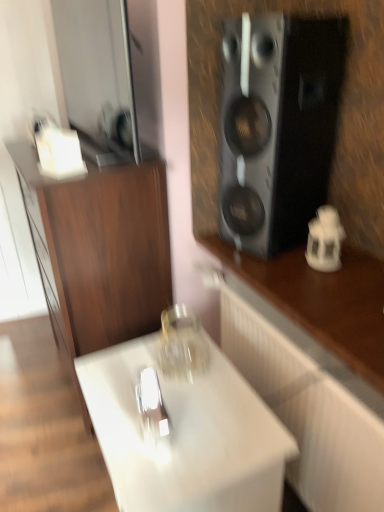
Find the location of a particular element. This screenshot has height=512, width=384. wooden cabinet at left, which appears as the 1th cabinetry when viewed from the left is located at coordinates (99, 251).

Locate an element on the screen. The image size is (384, 512). white glossy table at center is located at coordinates (186, 436).

Considering the positions of objects transparent glass jar at center and wooden cabinet at left, which appears as the 1th cabinetry when viewed from the left, in the image provided, who is in front, transparent glass jar at center or wooden cabinet at left, which appears as the 1th cabinetry when viewed from the left,?

transparent glass jar at center is in front.

From a real-world perspective, is transparent glass jar at center on top of wooden cabinet at left, which appears as the 1th cabinetry when viewed from the left?

Yes.

Can you tell me how much transparent glass jar at center and wooden cabinet at left, which appears as the 1th cabinetry when viewed from the left, differ in facing direction?

2.28 degrees.

Is transparent glass jar at center far from wooden cabinet at left, which is counted as the 2th cabinetry, starting from the right?

Actually, transparent glass jar at center and wooden cabinet at left, which is counted as the 2th cabinetry, starting from the right, are a little close together.

Measure the distance between wooden cabinet at left, which is counted as the 2th cabinetry, starting from the right, and white porcelain lantern at right.

wooden cabinet at left, which is counted as the 2th cabinetry, starting from the right, is 27.78 inches from white porcelain lantern at right.

Can you confirm if wooden cabinet at left, which appears as the 1th cabinetry when viewed from the left, is thinner than white porcelain lantern at right?

In fact, wooden cabinet at left, which appears as the 1th cabinetry when viewed from the left, might be wider than white porcelain lantern at right.

Does wooden cabinet at left, which is counted as the 2th cabinetry, starting from the right, lie behind white porcelain lantern at right?

No, the depth of wooden cabinet at left, which is counted as the 2th cabinetry, starting from the right, is less than that of white porcelain lantern at right.

You are a GUI agent. You are given a task and a screenshot of the screen. Output one action in this format:
    pyautogui.click(x=<x>, y=<y>)
    Task: Click on the cabinetry that is the 1st one below the white porcelain lantern at right (from a real-world perspective)
    
    Given the screenshot: What is the action you would take?
    pyautogui.click(x=99, y=251)

Between transparent glass jar at center and white porcelain lantern at right, which one appears on the left side from the viewer's perspective?

transparent glass jar at center.

From the picture: Is transparent glass jar at center facing away from white porcelain lantern at right?

Yes, transparent glass jar at center's orientation is away from white porcelain lantern at right.

Would you say transparent glass jar at center is a long distance from white porcelain lantern at right?

No.

Between white porcelain lantern at right and white glossy table at center, which one is positioned in front?

white glossy table at center is closer to the camera.

How far apart are white porcelain lantern at right and white glossy table at center?

white porcelain lantern at right and white glossy table at center are 27.64 inches apart.

From a real-world perspective, is white porcelain lantern at right physically above white glossy table at center?

Yes, from a real-world perspective, white porcelain lantern at right is over white glossy table at center

Considering the sizes of white porcelain lantern at right and white glossy table at center in the image, is white porcelain lantern at right taller or shorter than white glossy table at center?

Clearly, white porcelain lantern at right is shorter compared to white glossy table at center.

Who is smaller, transparent glass jar at center or white glossy table at center?

With smaller size is transparent glass jar at center.

Considering the relative sizes of transparent glass jar at center and white glossy table at center in the image provided, is transparent glass jar at center shorter than white glossy table at center?

Correct, transparent glass jar at center is not as tall as white glossy table at center.

From the image's perspective, is transparent glass jar at center located above or below white glossy table at center?

transparent glass jar at center is above white glossy table at center.

Is white porcelain lantern at right next to white glossy cabinet at lower center, the 1th cabinetry in the right-to-left sequence?

There is a gap between white porcelain lantern at right and white glossy cabinet at lower center, the 1th cabinetry in the right-to-left sequence.

From a real-world perspective, is white porcelain lantern at right located higher than white glossy cabinet at lower center, marked as the second cabinetry in a left-to-right arrangement?

Yes.

Considering the sizes of white porcelain lantern at right and white glossy cabinet at lower center, marked as the second cabinetry in a left-to-right arrangement, in the image, is white porcelain lantern at right taller or shorter than white glossy cabinet at lower center, marked as the second cabinetry in a left-to-right arrangement,?

Considering their sizes, white porcelain lantern at right has less height than white glossy cabinet at lower center, marked as the second cabinetry in a left-to-right arrangement.

Is white porcelain lantern at right not inside white glossy cabinet at lower center, marked as the second cabinetry in a left-to-right arrangement?

Yes.

Who is bigger, wooden cabinet at left, which appears as the 1th cabinetry when viewed from the left, or white glossy table at center?

wooden cabinet at left, which appears as the 1th cabinetry when viewed from the left.

Is point (154, 266) closer to viewer compared to point (150, 503)?

No, (154, 266) is further to viewer.

Is wooden cabinet at left, which is counted as the 2th cabinetry, starting from the right, looking in the opposite direction of white glossy table at center?

No, wooden cabinet at left, which is counted as the 2th cabinetry, starting from the right, is not facing away from white glossy table at center.

Can white glossy table at center be found inside wooden cabinet at left, which is counted as the 2th cabinetry, starting from the right?

No.

You are a GUI agent. You are given a task and a screenshot of the screen. Output one action in this format:
    pyautogui.click(x=<x>, y=<y>)
    Task: Click on the glass jar on the right of wooden cabinet at left, which appears as the 1th cabinetry when viewed from the left
    Image resolution: width=384 pixels, height=512 pixels.
    Given the screenshot: What is the action you would take?
    pyautogui.click(x=182, y=345)

I want to click on cabinetry that is the 1st one below the white porcelain lantern at right (from a real-world perspective), so click(99, 251).

Estimate the real-world distances between objects in this image. Which object is further from white porcelain lantern at right, transparent glass jar at center or white glossy cabinet at lower center, marked as the second cabinetry in a left-to-right arrangement?

The object further to white porcelain lantern at right is transparent glass jar at center.

Looking at the image, which one is located further to white glossy cabinet at lower center, the 1th cabinetry in the right-to-left sequence, wooden cabinet at left, which appears as the 1th cabinetry when viewed from the left, or black matte speaker at upper right?

Among the two, wooden cabinet at left, which appears as the 1th cabinetry when viewed from the left, is located further to white glossy cabinet at lower center, the 1th cabinetry in the right-to-left sequence.

Consider the image. From the image, which object appears to be farther from wooden cabinet at left, which is counted as the 2th cabinetry, starting from the right, white glossy table at center or white porcelain lantern at right?

white porcelain lantern at right.

When comparing their distances from white glossy cabinet at lower center, marked as the second cabinetry in a left-to-right arrangement, does wooden cabinet at left, which appears as the 1th cabinetry when viewed from the left, or white glossy table at center seem closer?

Based on the image, white glossy table at center appears to be nearer to white glossy cabinet at lower center, marked as the second cabinetry in a left-to-right arrangement.

When comparing their distances from white glossy cabinet at lower center, the 1th cabinetry in the right-to-left sequence, does black matte speaker at upper right or transparent glass jar at center seem closer?

transparent glass jar at center is closer to white glossy cabinet at lower center, the 1th cabinetry in the right-to-left sequence.

From the image, which object appears to be nearer to white glossy table at center, white glossy cabinet at lower center, the 1th cabinetry in the right-to-left sequence, or black matte speaker at upper right?

Based on the image, white glossy cabinet at lower center, the 1th cabinetry in the right-to-left sequence, appears to be nearer to white glossy table at center.

Consider the image. Considering their positions, is white glossy table at center positioned further to black matte speaker at upper right than white porcelain lantern at right?

Among the two, white glossy table at center is located further to black matte speaker at upper right.

Based on their spatial positions, is white glossy table at center or transparent glass jar at center closer to wooden cabinet at left, which is counted as the 2th cabinetry, starting from the right?

transparent glass jar at center lies closer to wooden cabinet at left, which is counted as the 2th cabinetry, starting from the right, than the other object.

This screenshot has width=384, height=512. I want to click on glass jar between black matte speaker at upper right and white glossy cabinet at lower center, marked as the second cabinetry in a left-to-right arrangement, in the up-down direction, so click(182, 345).

Find the location of a particular element. cabinetry between wooden cabinet at left, which appears as the 1th cabinetry when viewed from the left, and white porcelain lantern at right is located at coordinates (313, 364).

Identify the location of glass jar between wooden cabinet at left, which appears as the 1th cabinetry when viewed from the left, and white glossy table at center in the up-down direction. This screenshot has width=384, height=512. (182, 345).

Identify the location of appliance between black matte speaker at upper right and white glossy cabinet at lower center, the 1th cabinetry in the right-to-left sequence, from top to bottom. (325, 240).